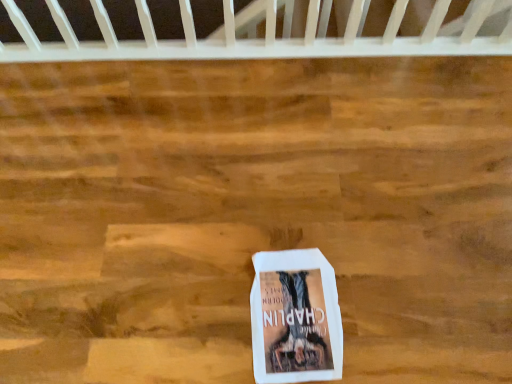
Question: Should I look upward or downward to see white plastic crib at upper center?

Choices:
 (A) down
 (B) up

Answer: (B)

Question: From a real-world perspective, is white plastic crib at upper center under white paper book at center?

Choices:
 (A) no
 (B) yes

Answer: (A)

Question: Are white plastic crib at upper center and white paper book at center located far from each other?

Choices:
 (A) yes
 (B) no

Answer: (B)

Question: Does white plastic crib at upper center have a greater width compared to white paper book at center?

Choices:
 (A) no
 (B) yes

Answer: (A)

Question: Is white plastic crib at upper center smaller than white paper book at center?

Choices:
 (A) no
 (B) yes

Answer: (A)

Question: Is white plastic crib at upper center oriented towards white paper book at center?

Choices:
 (A) no
 (B) yes

Answer: (B)

Question: Is white plastic crib at upper center next to white paper book at center and touching it?

Choices:
 (A) yes
 (B) no

Answer: (B)

Question: Considering the relative sizes of white paper book at center and white plastic crib at upper center in the image provided, is white paper book at center smaller than white plastic crib at upper center?

Choices:
 (A) yes
 (B) no

Answer: (A)

Question: Considering the relative positions of white paper book at center and white plastic crib at upper center in the image provided, is white paper book at center to the right of white plastic crib at upper center from the viewer's perspective?

Choices:
 (A) no
 (B) yes

Answer: (B)

Question: Is white plastic crib at upper center completely or partially inside white paper book at center?

Choices:
 (A) yes
 (B) no

Answer: (B)

Question: Can you confirm if white paper book at center is shorter than white plastic crib at upper center?

Choices:
 (A) no
 (B) yes

Answer: (B)

Question: Is white paper book at center in contact with white plastic crib at upper center?

Choices:
 (A) yes
 (B) no

Answer: (B)

Question: Can you confirm if white paper book at center is bigger than white plastic crib at upper center?

Choices:
 (A) yes
 (B) no

Answer: (B)

Question: From a real-world perspective, is white paper book at center positioned above or below white plastic crib at upper center?

Choices:
 (A) below
 (B) above

Answer: (A)